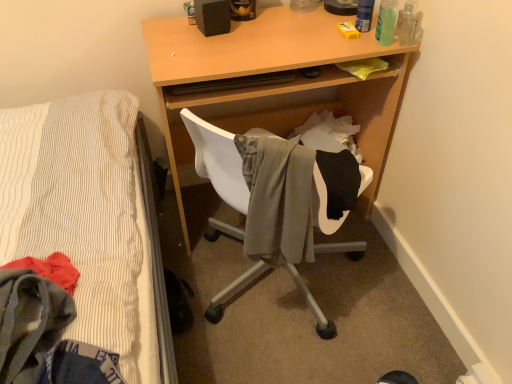
Question: From a real-world perspective, is green translucent bottle at upper right, arranged as the 2th bottle when viewed from the right, physically located above or below translucent plastic bottle at upper right, the 3th bottle positioned from the right?

Choices:
 (A) below
 (B) above

Answer: (A)

Question: Is green translucent bottle at upper right, arranged as the 2th bottle when viewed from the right, inside the boundaries of translucent plastic bottle at upper right, marked as the 1th bottle in a left-to-right arrangement, or outside?

Choices:
 (A) outside
 (B) inside

Answer: (A)

Question: Which object is positioned farthest from the gray fabric chair at center?

Choices:
 (A) clear plastic bottle at upper right, marked as the 1th bottle in a right-to-left arrangement
 (B) matte black speaker at upper center
 (C) green translucent bottle at upper right, arranged as the 2th bottle when viewed from the right
 (D) translucent plastic bottle at upper right, marked as the 1th bottle in a left-to-right arrangement
 (E) light wood desk at center

Answer: (A)

Question: Which object is the closest to the gray fabric chair at center?

Choices:
 (A) clear plastic bottle at upper right, marked as the 1th bottle in a right-to-left arrangement
 (B) light wood desk at center
 (C) translucent plastic bottle at upper right, the 3th bottle positioned from the right
 (D) matte black speaker at upper center
 (E) green translucent bottle at upper right, arranged as the 2th bottle when viewed from the right

Answer: (B)